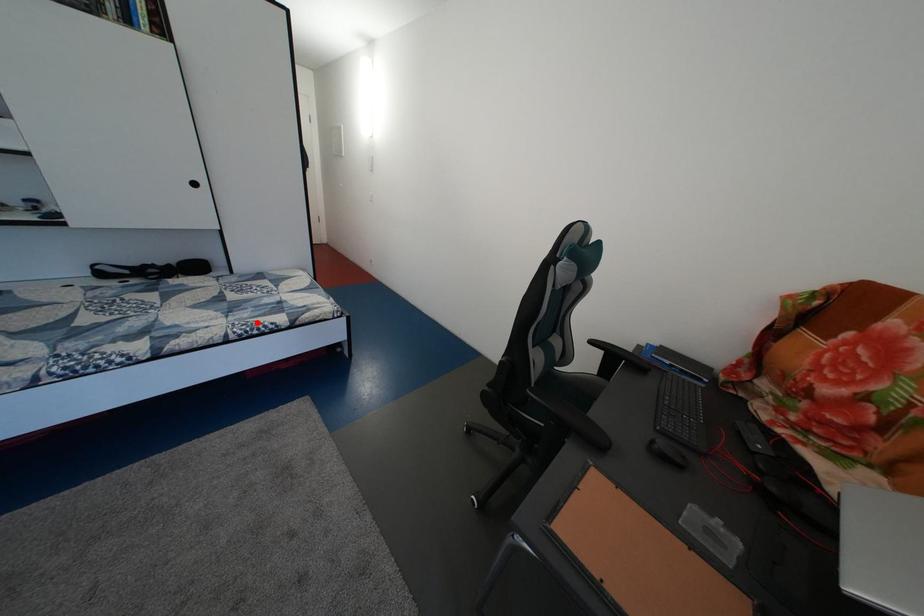
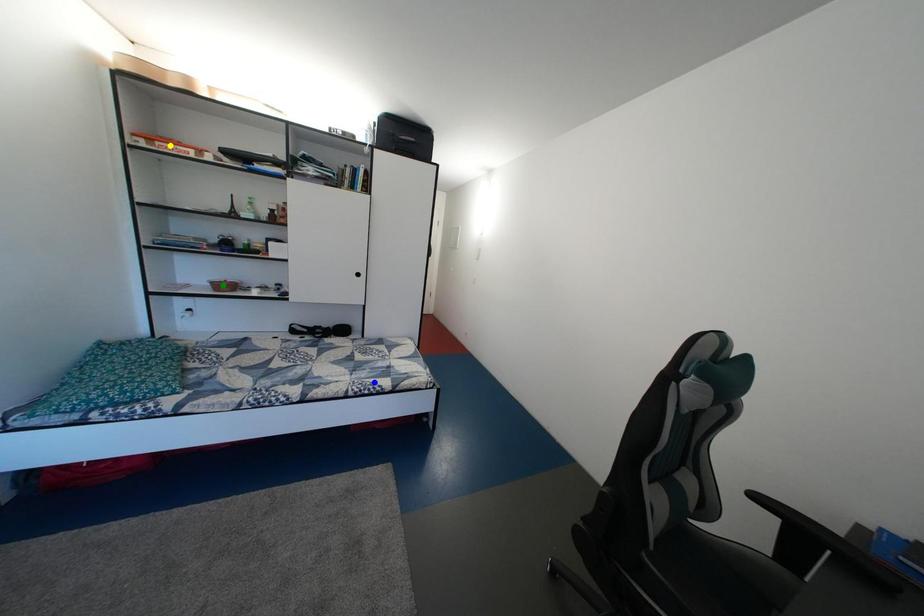
Question: I am providing you with two images of the same scene from different viewpoints. A red point is marked on the first image. You are given multiple points on the second image. Can you choose the point in image 2 that corresponds to the point in image 1?

Choices:
 (A) yellow point
 (B) green point
 (C) blue point

Answer: (C)